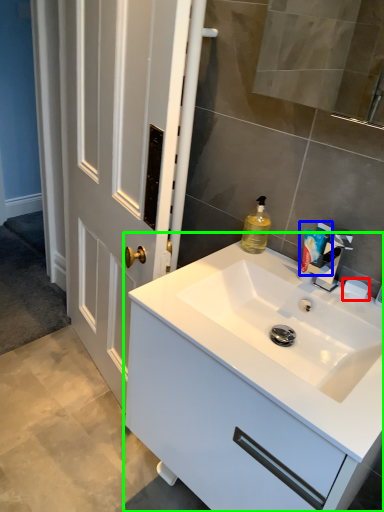
Question: Which object is the farthest from soap (highlighted by a red box)? Choose among these: toiletry (highlighted by a blue box) or bathroom cabinet (highlighted by a green box).

Choices:
 (A) toiletry
 (B) bathroom cabinet

Answer: (B)